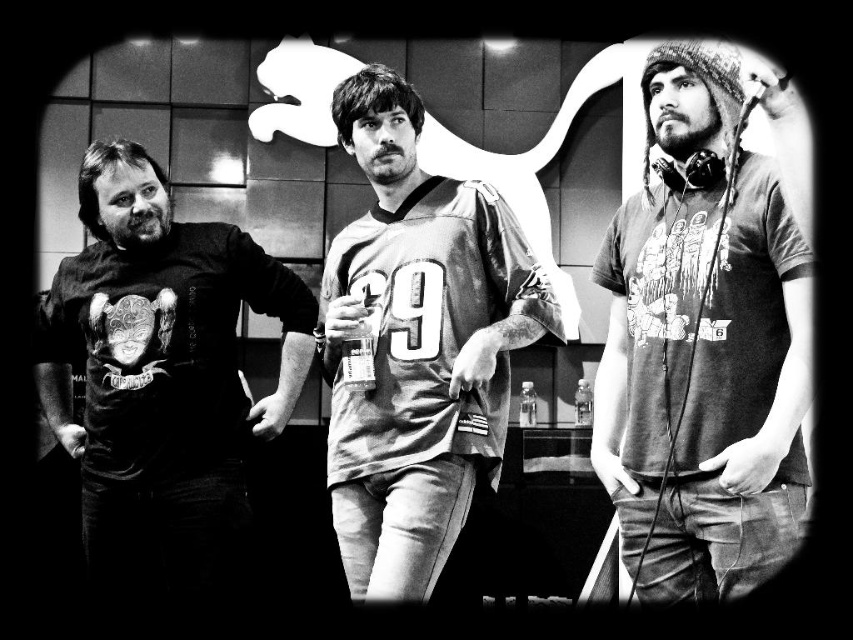
You are standing in front of a black and white photo of three people. There is a point at coordinates point [769,461]. If you want to touch that point with a 2.5 meter long stick, can you reach it?

The distance between point [769,461] and the viewer is 2.27 meters. Since the stick is 2.5 meters long, you can reach the point with the stick.